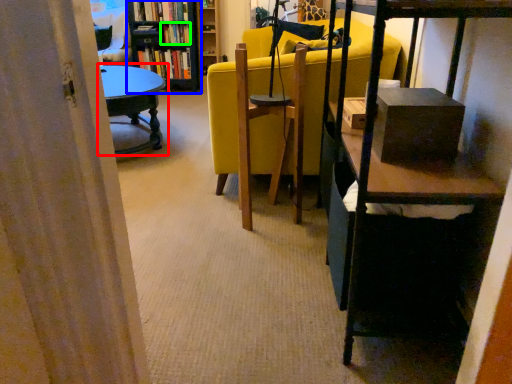
Question: Estimate the real-world distances between objects in this image. Which object is farther from table (highlighted by a red box), bookcase (highlighted by a blue box) or book (highlighted by a green box)?

Choices:
 (A) bookcase
 (B) book

Answer: (B)